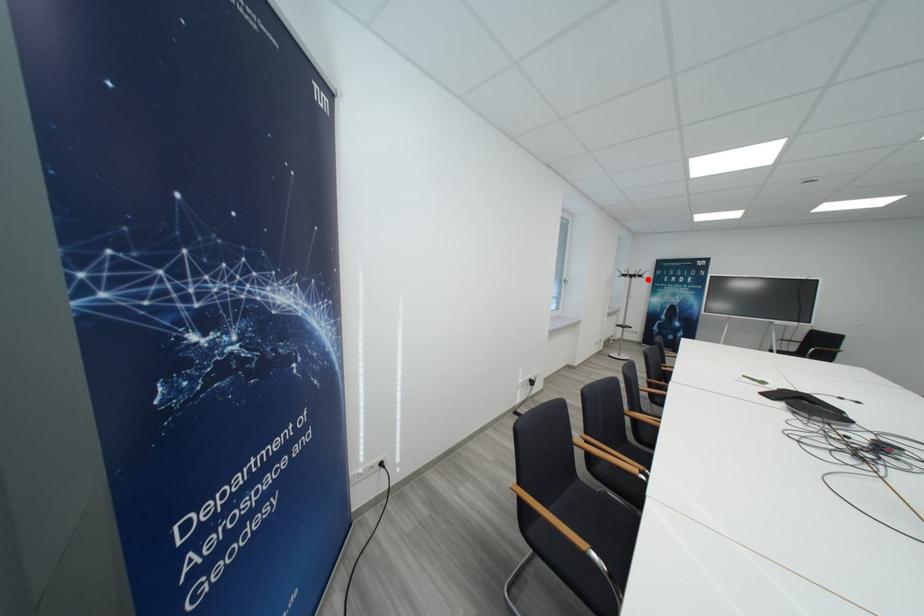
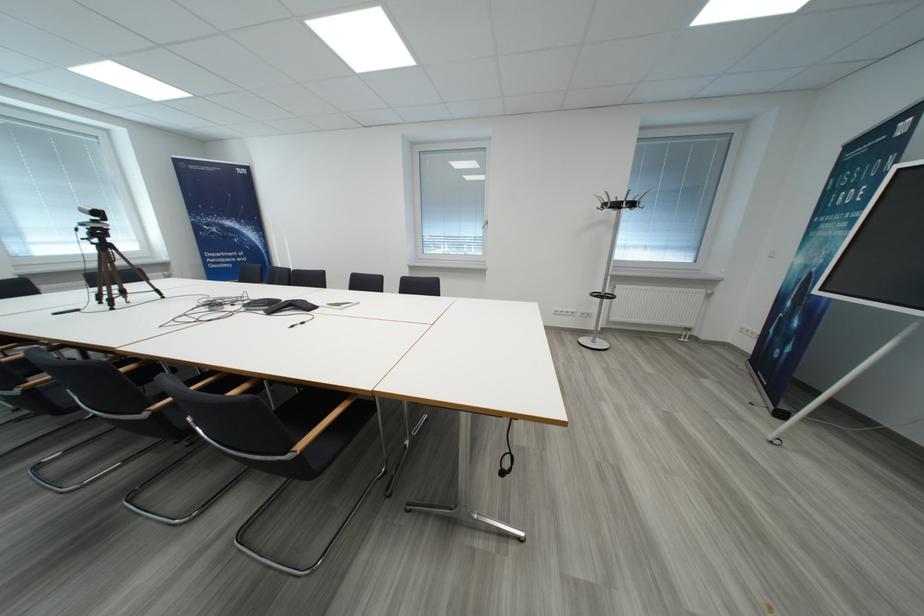
Find the pixel in the second image that matches the highlighted location in the first image.

(623, 208)